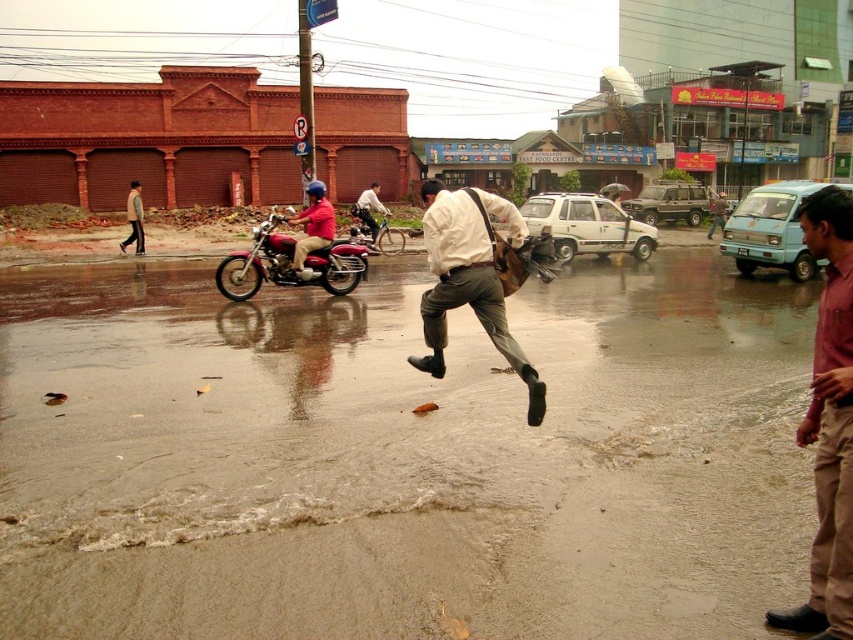
Question: Which object is farther from the camera taking this photo?

Choices:
 (A) maroon metallic motorcycle at center-left
 (B) shiny chrome motorcycle at center

Answer: (B)

Question: Does maroon metallic motorcycle at center-left appear under matte red motorcycle at center?

Choices:
 (A) no
 (B) yes

Answer: (B)

Question: Is brown textured flood at lower center below brown cotton pants at right?

Choices:
 (A) yes
 (B) no

Answer: (B)

Question: Estimate the real-world distances between objects in this image. Which object is farther from the maroon metallic motorcycle at center-left?

Choices:
 (A) dark gray pants at center
 (B) shiny chrome motorcycle at center
 (C) brown cotton pants at right

Answer: (C)

Question: Does brown textured flood at lower center appear on the left side of maroon metallic motorcycle at center-left?

Choices:
 (A) yes
 (B) no

Answer: (B)

Question: Which object appears farthest from the camera in this image?

Choices:
 (A) shiny chrome motorcycle at center
 (B) brown cotton pants at right

Answer: (A)